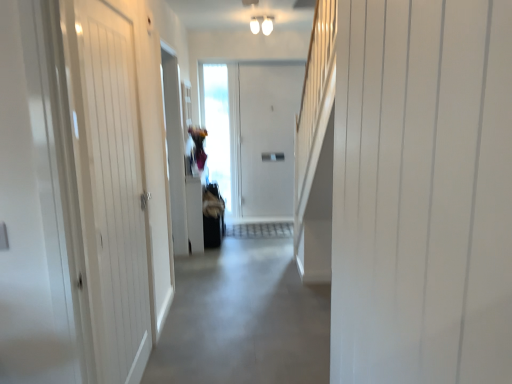
Question: Is white smooth door at right, the 2th door positioned from the left, in front of or behind gray concrete floor at center in the image?

Choices:
 (A) behind
 (B) front

Answer: (B)

Question: From their relative heights in the image, would you say white smooth door at right, which appears as the 1th door when viewed from the right, is taller or shorter than gray concrete floor at center?

Choices:
 (A) tall
 (B) short

Answer: (A)

Question: Considering the real-world distances, which object is closest to the gray concrete floor at center?

Choices:
 (A) white smooth door at right, which appears as the 1th door when viewed from the right
 (B) white wooden door at left, the second door from the right

Answer: (B)

Question: Which object is positioned closest to the gray concrete floor at center?

Choices:
 (A) white smooth door at right, the 2th door positioned from the left
 (B) white wooden door at left, the 1th door in the left-to-right sequence

Answer: (B)